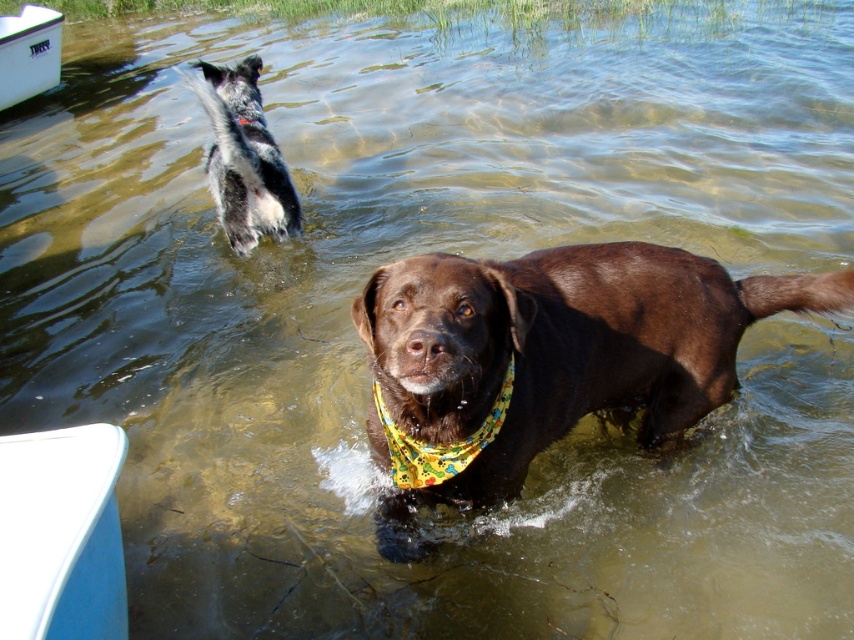
You are a photographer trying to capture both the brown matte dog at center and the black and white fur at upper left in a single shot. Based on their positions, which dog is closer to the left edge of the frame?

The black and white fur at upper left is closer to the left edge of the frame because the brown matte dog at center is positioned to the right of it.

You are a photographer trying to capture the black and white fur at upper left and the yellow fabric bandana at center. Which object is closer to the camera?

The black and white fur at upper left is closer to the camera because the yellow fabric bandana at center is behind it.